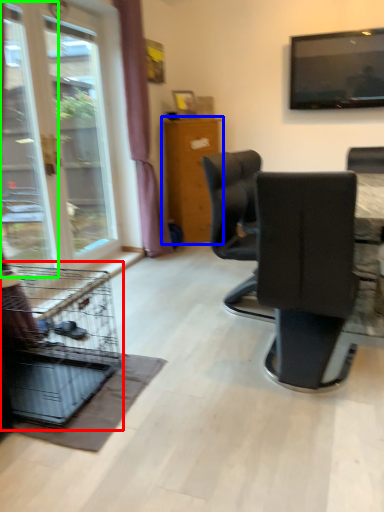
Question: Based on their relative distances, which object is nearer to bird cage (highlighted by a red box)? Choose from furniture (highlighted by a blue box) and screen door (highlighted by a green box).

Choices:
 (A) furniture
 (B) screen door

Answer: (B)